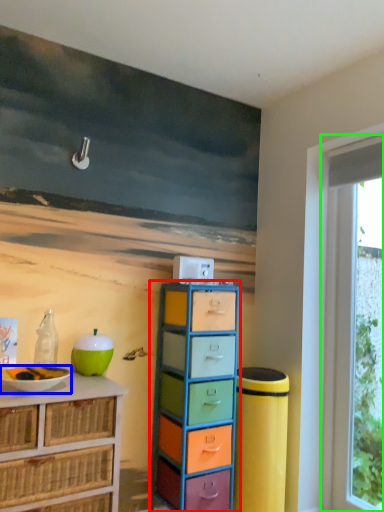
Question: Estimate the real-world distances between objects in this image. Which object is farther from chest of drawers (highlighted by a red box), bowl (highlighted by a blue box) or window (highlighted by a green box)?

Choices:
 (A) bowl
 (B) window

Answer: (B)